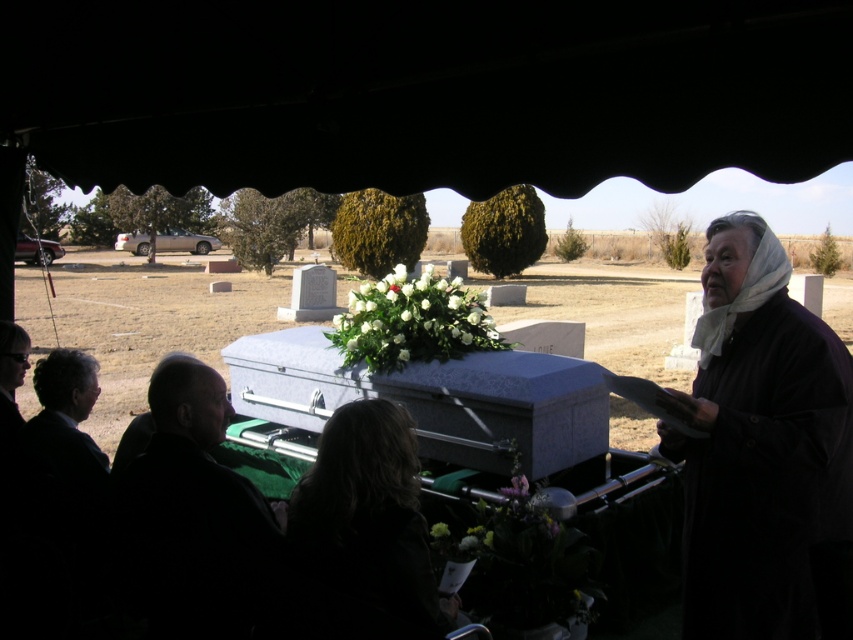
Question: Which of the following is the closest to the observer?

Choices:
 (A) (433, 296)
 (B) (409, 464)
 (C) (434, 532)

Answer: (B)

Question: Does dark brown hair at lower center have a larger size compared to green matte flower at center?

Choices:
 (A) no
 (B) yes

Answer: (B)

Question: Can you confirm if black matte robe at right is wider than green matte flower at center?

Choices:
 (A) yes
 (B) no

Answer: (A)

Question: Based on their relative distances, which object is nearer to the dark brown hair at lower center?

Choices:
 (A) white matte floral arrangement at center
 (B) black matte robe at right

Answer: (B)

Question: Which is nearer to the dark brown hair at lower center?

Choices:
 (A) green matte flower at center
 (B) black matte robe at right

Answer: (A)

Question: Considering the relative positions of black matte robe at right and dark brown hair at lower center in the image provided, where is black matte robe at right located with respect to dark brown hair at lower center?

Choices:
 (A) above
 (B) below

Answer: (A)